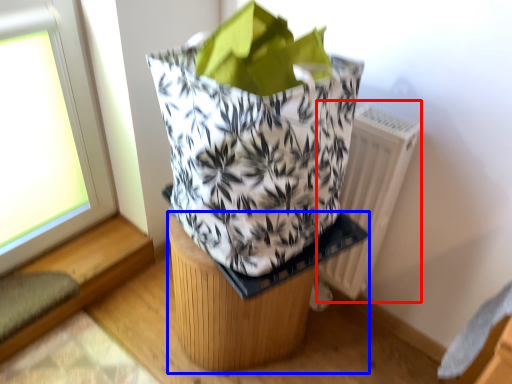
Question: Which of the following is the closest to the observer, radiator (highlighted by a red box) or furniture (highlighted by a blue box)?

Choices:
 (A) radiator
 (B) furniture

Answer: (B)